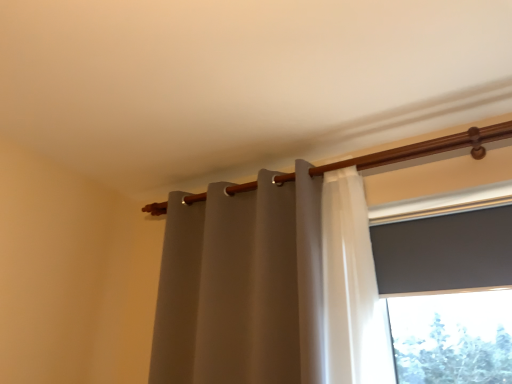
Question: Considering the positions of point (463, 251) and point (189, 362), is point (463, 251) closer or farther from the camera than point (189, 362)?

Choices:
 (A) farther
 (B) closer

Answer: (B)

Question: Is matte gray screen at upper right taller or shorter than matte gray curtain at center?

Choices:
 (A) short
 (B) tall

Answer: (A)

Question: Which object is the closest to the wooden curtain rod at upper center?

Choices:
 (A) matte gray screen at upper right
 (B) matte gray curtain at center

Answer: (A)

Question: Estimate the real-world distances between objects in this image. Which object is closer to the wooden curtain rod at upper center?

Choices:
 (A) matte gray curtain at center
 (B) matte gray screen at upper right

Answer: (B)